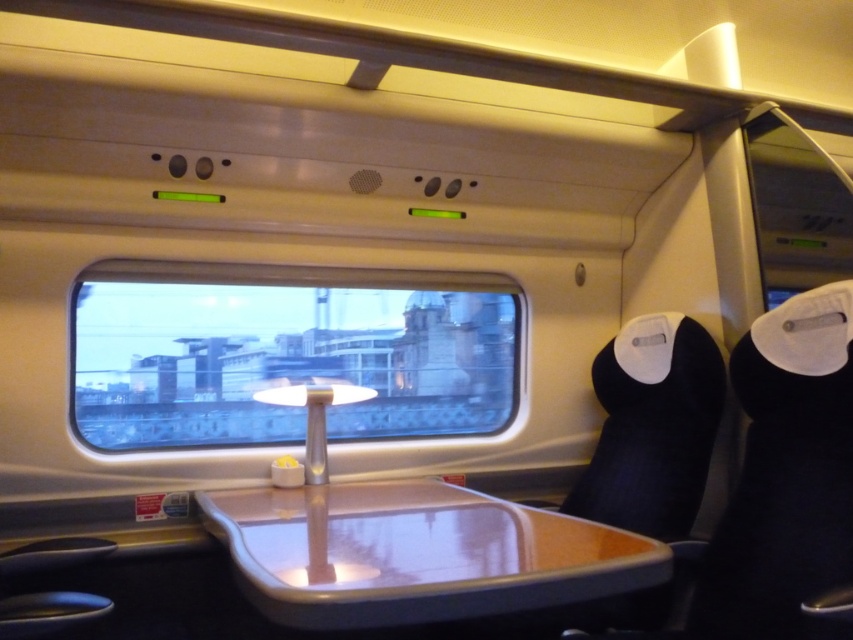
Looking at this image, can you confirm if transparent glass window at center is bigger than matte plastic tray at center?

Yes, transparent glass window at center is bigger than matte plastic tray at center.

Which is above, transparent glass window at center or matte plastic tray at center?

transparent glass window at center

Between point (358, 324) and point (363, 593), which one is positioned in front?

Point (363, 593) is in front.

The image size is (853, 640). What are the coordinates of `transparent glass window at center` in the screenshot? It's located at (286, 353).